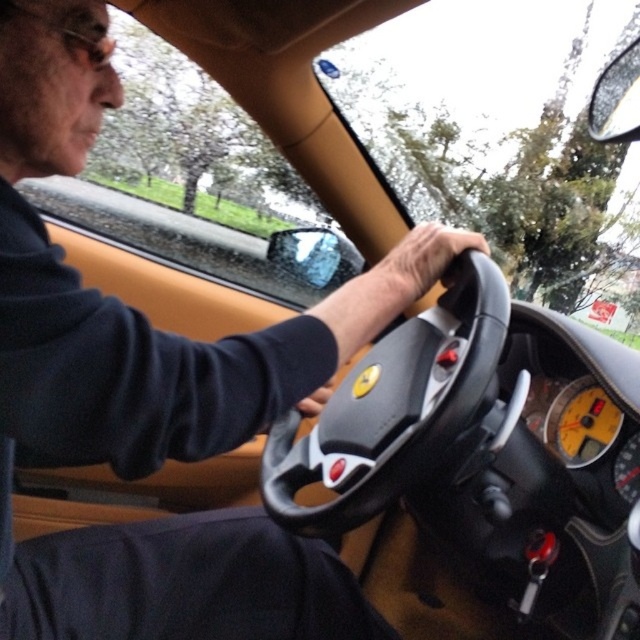
Question: Is leather/smooth steering wheel at center positioned before leather at steering wheel center?

Choices:
 (A) yes
 (B) no

Answer: (A)

Question: Can you confirm if leather at center is positioned to the right of leather at steering wheel center?

Choices:
 (A) no
 (B) yes

Answer: (B)

Question: Among these objects, which one is nearest to the camera?

Choices:
 (A) leather/smooth steering wheel at center
 (B) leather at center

Answer: (A)

Question: Does transparent glass windshield at upper center come behind leather at center?

Choices:
 (A) no
 (B) yes

Answer: (B)

Question: Which is nearer to the transparent glass windshield at upper center?

Choices:
 (A) leather/smooth steering wheel at center
 (B) leather at center
 (C) leather at steering wheel center

Answer: (A)

Question: Estimate the real-world distances between objects in this image. Which object is closer to the leather at steering wheel center?

Choices:
 (A) leather/smooth steering wheel at center
 (B) leather at center

Answer: (A)